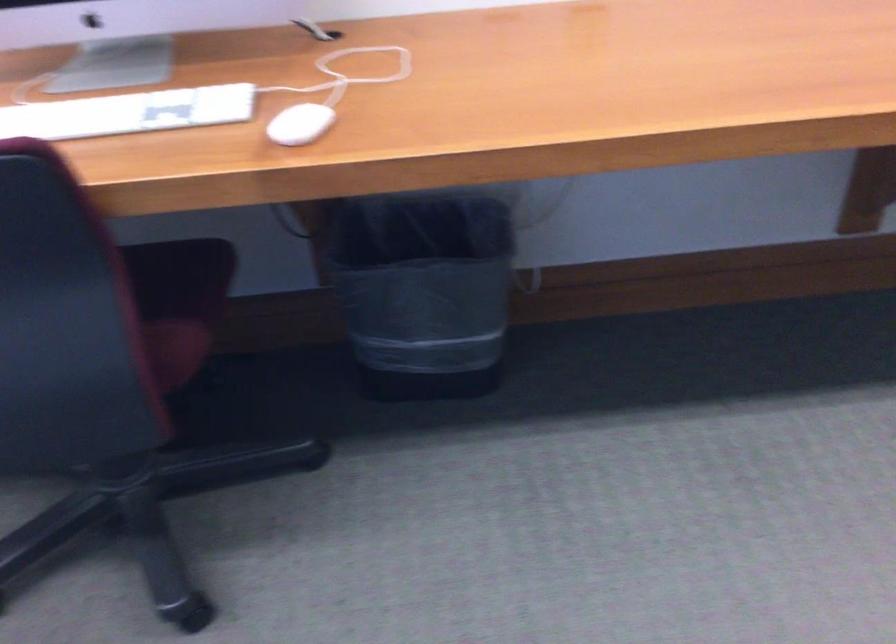
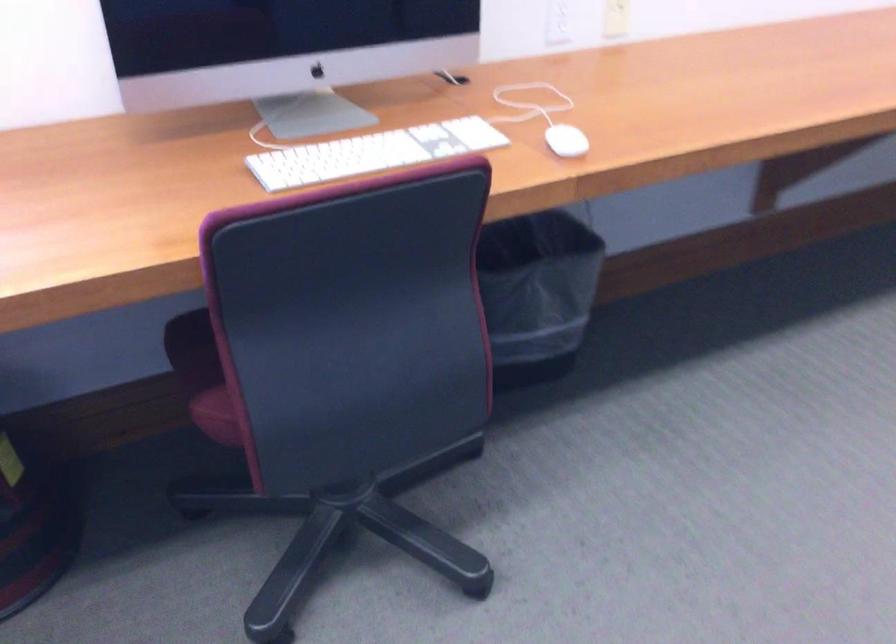
The point at (91,118) is marked in the first image. Where is the corresponding point in the second image?

(372, 153)